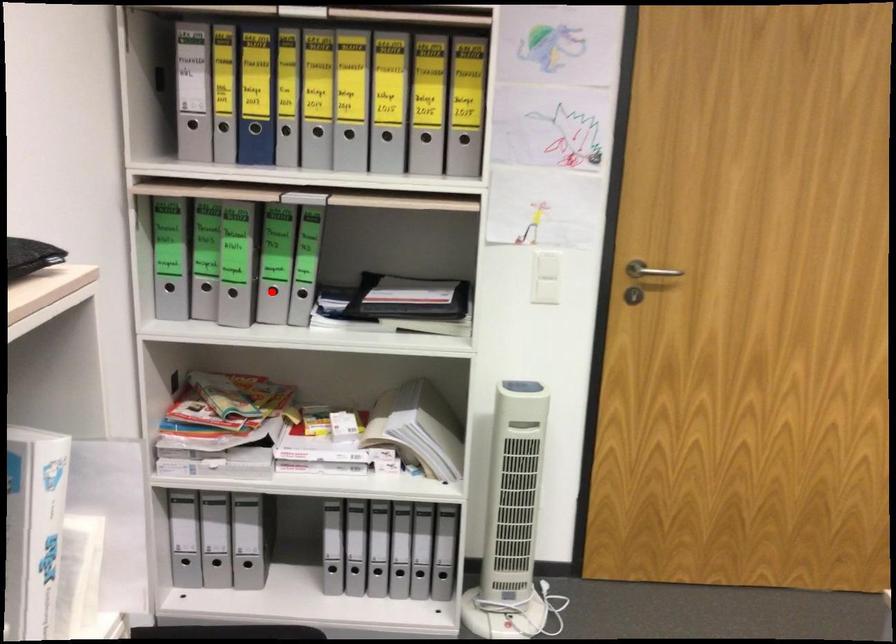
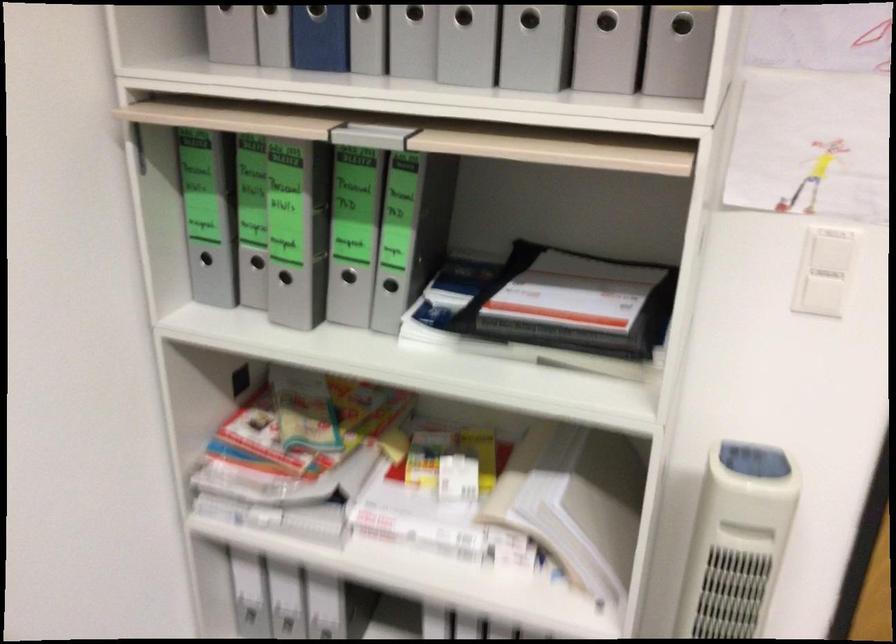
Question: I am providing you with two images of the same scene from different viewpoints. In image1, a red point is highlighted. Considering the same 3D point in image2, which of the following is correct?

Choices:
 (A) It is closer
 (B) It is farther

Answer: (A)